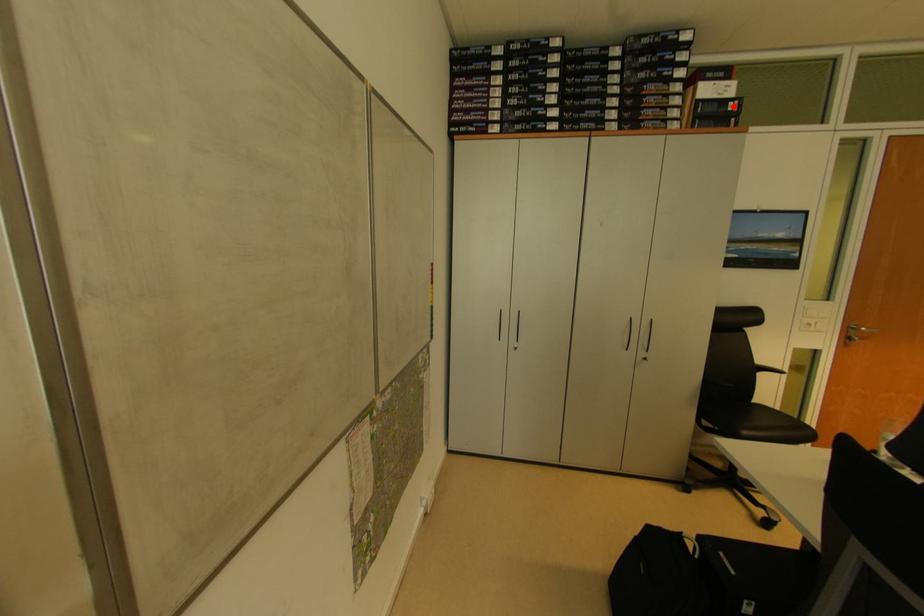
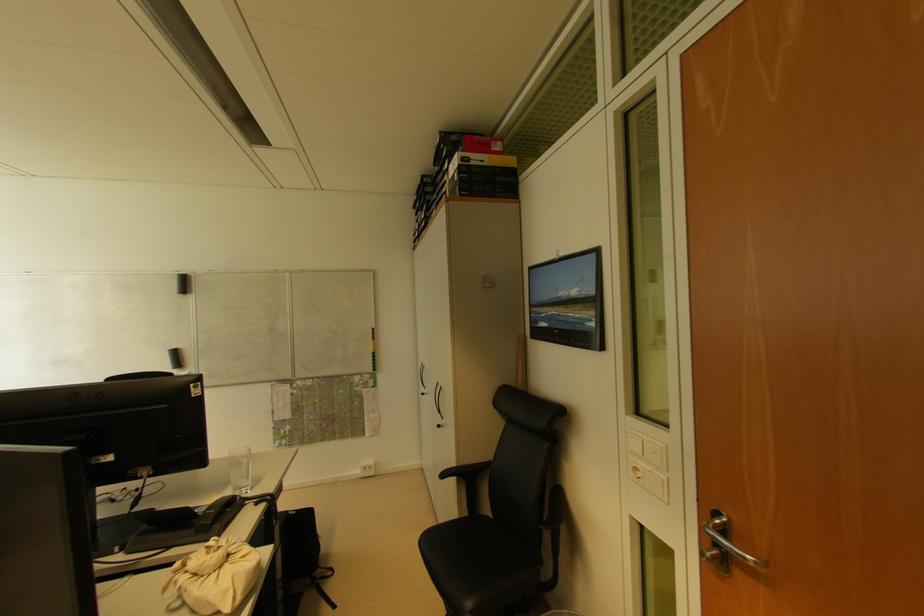
Locate, in the second image, the point that corresponds to the highlighted location in the first image.

(457, 177)